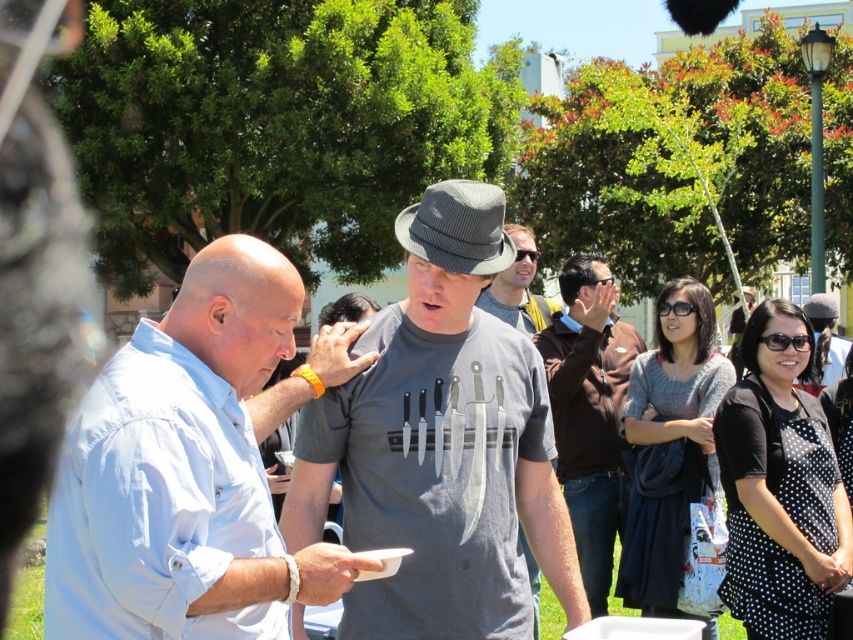
Question: Is light blue cotton shirt at center bigger than gray matte shirt at center?

Choices:
 (A) no
 (B) yes

Answer: (A)

Question: Is the position of gray matte t-shirt at center more distant than that of gray matte hat at center?

Choices:
 (A) yes
 (B) no

Answer: (B)

Question: In this image, where is gray matte hat at center located relative to gray matte shirt at center?

Choices:
 (A) above
 (B) below

Answer: (A)

Question: Considering the real-world distances, which object is farthest from the light blue cotton shirt at center?

Choices:
 (A) gray matte hat at center
 (B) gray matte t-shirt at center
 (C) brown leather jacket at center
 (D) gray fabric shirt at center

Answer: (C)

Question: Which point is farther to the camera?

Choices:
 (A) light blue cotton shirt at center
 (B) gray matte hat at center
 (C) gray matte shirt at center

Answer: (C)

Question: Which object appears farthest from the camera in this image?

Choices:
 (A) gray fabric shirt at center
 (B) gray matte t-shirt at center
 (C) light blue cotton shirt at center
 (D) gray matte shirt at center

Answer: (D)